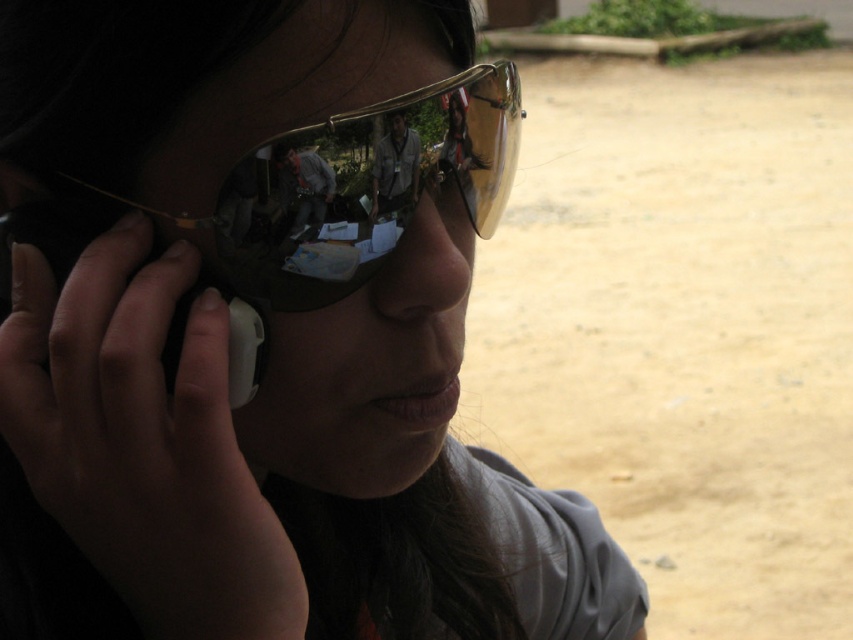
Is gold reflective sunglasses at center above black plastic smartphone at left?

Yes.

Between gold reflective sunglasses at center and black plastic smartphone at left, which one is positioned higher?

gold reflective sunglasses at center is higher up.

Does point (468, 220) lie in front of point (61, 260)?

No, it is behind (61, 260).

You are a GUI agent. You are given a task and a screenshot of the screen. Output one action in this format:
    pyautogui.click(x=<x>, y=<y>)
    Task: Click on the gold reflective sunglasses at center
    This screenshot has height=640, width=853.
    Given the screenshot: What is the action you would take?
    pyautogui.click(x=357, y=186)